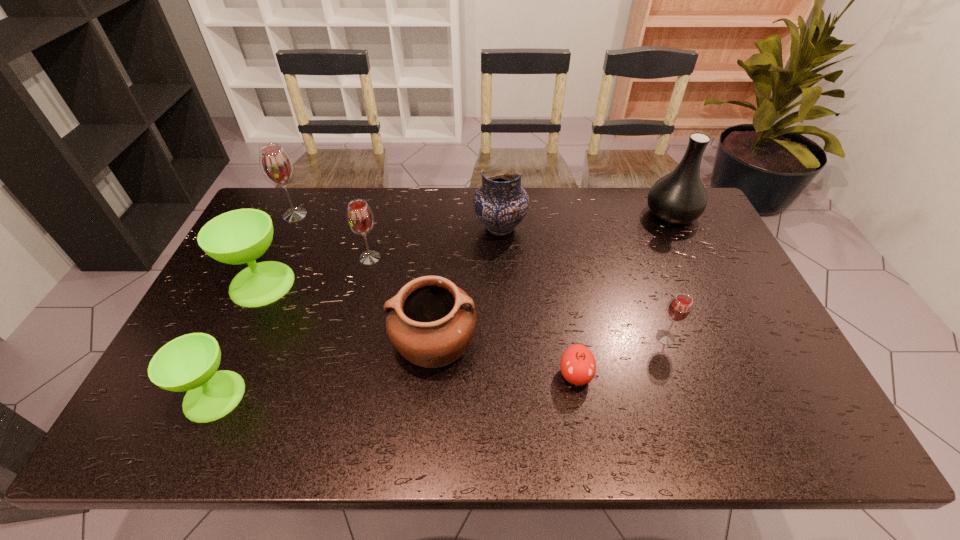
This screenshot has width=960, height=540. What are the coordinates of `vacant space in between the second wineglass from right to left and the bigger green wineglass` in the screenshot? It's located at (316, 271).

Locate an element on the screen. This screenshot has width=960, height=540. vacant point located between the nearer green wineglass and the farther green wineglass is located at coordinates (238, 340).

Locate an element on the screen. free spot between the fourth object from left to right and the second nearest wineglass is located at coordinates (517, 298).

Where is `free space between the red apple and the smallest red wineglass`? free space between the red apple and the smallest red wineglass is located at coordinates (620, 356).

What are the coordinates of `free space between the nearer pottery and the nearest wineglass` in the screenshot? It's located at click(324, 369).

Identify the location of the second closest object to the shortest object. (430, 321).

Find the location of a particular element. object that is the sixth closest one to the second biggest red wineglass is located at coordinates (578, 366).

Locate which wineglass ranks second in proximity to the bigger green wineglass. Please provide its 2D coordinates. Your answer should be formatted as a tuple, i.e. [(x, y)], where the tuple contains the x and y coordinates of a point satisfying the conditions above.

[(276, 165)]

This screenshot has height=540, width=960. I want to click on the closest wineglass to the rightmost object, so click(679, 309).

Identify which red wineglass is located as the second nearest to the fourth farthest wineglass. Please provide its 2D coordinates. Your answer should be formatted as a tuple, i.e. [(x, y)], where the tuple contains the x and y coordinates of a point satisfying the conditions above.

[(276, 165)]